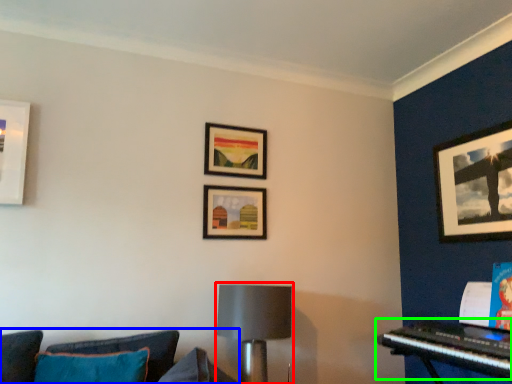
Question: Which object is the closest to the lamp (highlighted by a red box)? Choose among these: studio couch (highlighted by a blue box) or piano (highlighted by a green box).

Choices:
 (A) studio couch
 (B) piano

Answer: (A)